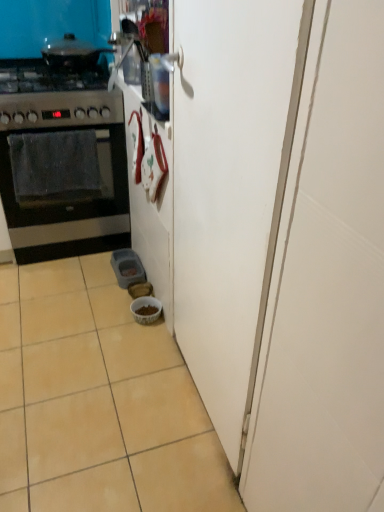
Find the location of a particular element. The image size is (384, 512). vacant area that is in front of white matte door at center is located at coordinates (167, 462).